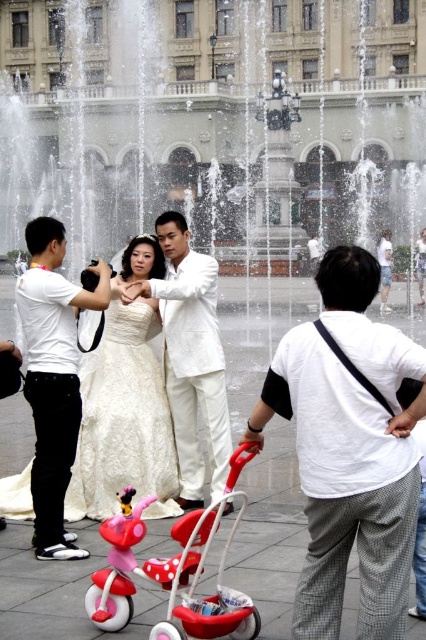
Which is more to the right, white matte shirt at left or matte pink plastic baby carriage at center?

Positioned to the right is matte pink plastic baby carriage at center.

Based on the photo, can you confirm if white matte shirt at left is positioned to the left of matte pink plastic baby carriage at center?

Correct, you'll find white matte shirt at left to the left of matte pink plastic baby carriage at center.

Is point (60, 326) farther from camera compared to point (201, 611)?

Yes.

The image size is (426, 640). I want to click on white matte shirt at left, so [x=52, y=378].

Can you confirm if white satin dress at center is positioned to the left of white matte shirt at left?

In fact, white satin dress at center is to the right of white matte shirt at left.

Who is positioned more to the right, white satin dress at center or white matte shirt at left?

white satin dress at center is more to the right.

Is point (117, 444) positioned after point (60, 349)?

Yes, it is behind point (60, 349).

You are a GUI agent. You are given a task and a screenshot of the screen. Output one action in this format:
    pyautogui.click(x=<x>, y=<y>)
    Task: Click on the white satin dress at center
    The image size is (426, 640).
    Given the screenshot: What is the action you would take?
    pyautogui.click(x=123, y=420)

Is point (319, 588) positioned before point (184, 596)?

Yes, point (319, 588) is closer to viewer.

Find the location of a particular element. This screenshot has height=640, width=426. white cotton shirt at center is located at coordinates (350, 451).

Image resolution: width=426 pixels, height=640 pixels. I want to click on white cotton shirt at center, so 350,451.